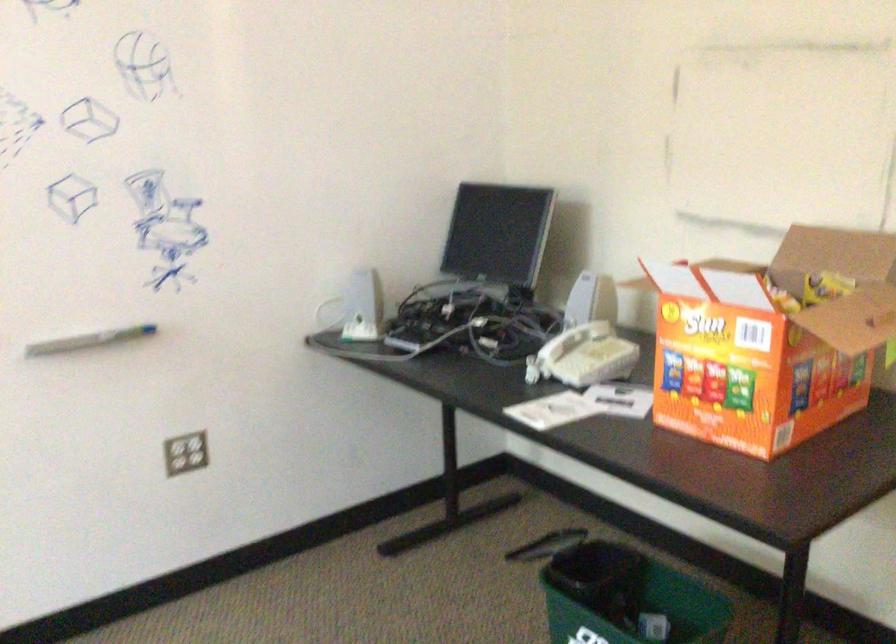
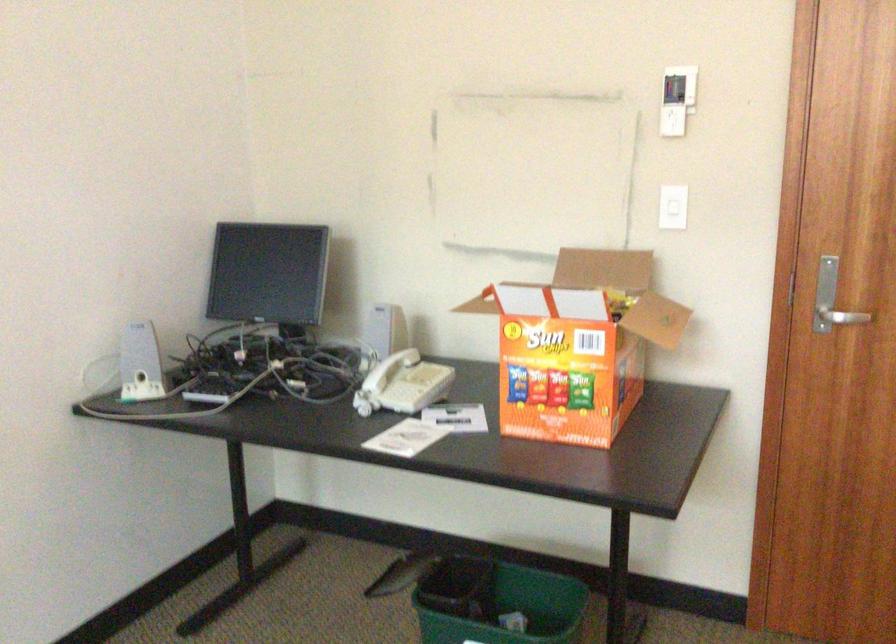
Question: I am providing you with two images of the same scene from different viewpoints. Please identify which objects are invisible in image2.

Choices:
 (A) chip bag
 (B) white light switch
 (C) green trash can
 (D) light blue container lid

Answer: (A)